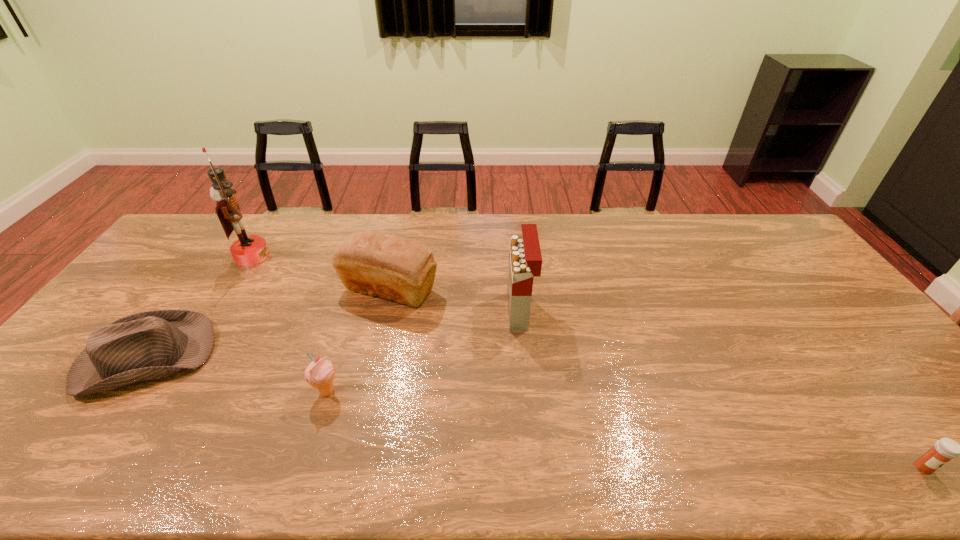
Where is `object that is at the near right corner`? object that is at the near right corner is located at coordinates (945, 449).

This screenshot has height=540, width=960. I want to click on vacant region at the far edge, so 554,227.

You are a GUI agent. You are given a task and a screenshot of the screen. Output one action in this format:
    pyautogui.click(x=<x>, y=<y>)
    Task: Click on the vacant region at the near edge of the desktop
    Image resolution: width=960 pixels, height=540 pixels.
    Given the screenshot: What is the action you would take?
    pyautogui.click(x=463, y=451)

I want to click on free space at the left edge of the desktop, so click(134, 314).

You are a GUI agent. You are given a task and a screenshot of the screen. Output one action in this format:
    pyautogui.click(x=<x>, y=<y>)
    Task: Click on the free region at the right edge of the desktop
    The height and width of the screenshot is (540, 960).
    Given the screenshot: What is the action you would take?
    pyautogui.click(x=809, y=286)

The width and height of the screenshot is (960, 540). Find the location of `empty location between the rightmost object and the icecream`. empty location between the rightmost object and the icecream is located at coordinates (625, 429).

Identify the location of vacant area that lies between the third tallest object and the farthest object. (321, 273).

Identify the location of free space between the bread and the tallest object. point(321,273).

At what (x,y) coordinates should I click in order to perform the action: click on vacant space in between the fedora and the icecream. Please return your answer as a coordinate pair (x, y). The width and height of the screenshot is (960, 540). Looking at the image, I should click on (236, 375).

Image resolution: width=960 pixels, height=540 pixels. What are the coordinates of `blank region between the rightmost object and the farthest object` in the screenshot? It's located at (588, 361).